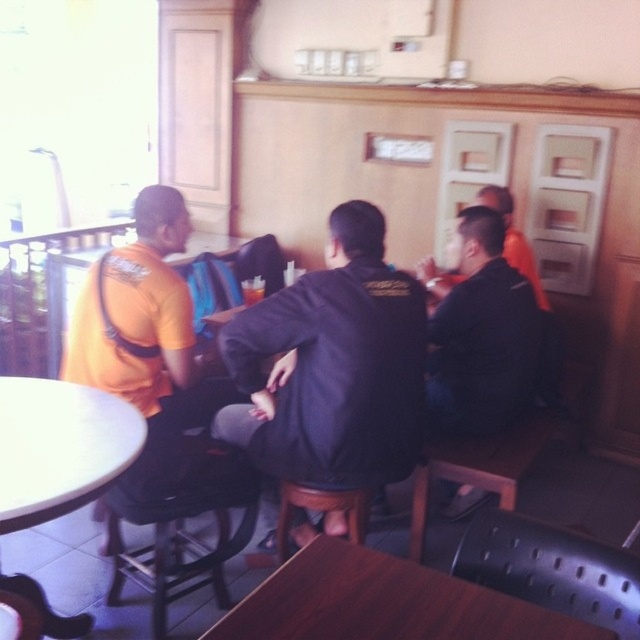
Looking at this image, is dark blue jacket at center below black matte jacket at upper right?

Yes.

Who is more forward, (483, 417) or (429, 280)?

Point (483, 417) is in front.

You are a GUI agent. You are given a task and a screenshot of the screen. Output one action in this format:
    pyautogui.click(x=<x>, y=<y>)
    Task: Click on the dark blue jacket at center
    
    Given the screenshot: What is the action you would take?
    pyautogui.click(x=481, y=333)

Is orange matte shirt at left smaller than black matte jacket at upper right?

Incorrect, orange matte shirt at left is not smaller in size than black matte jacket at upper right.

What do you see at coordinates (141, 328) in the screenshot? I see `orange matte shirt at left` at bounding box center [141, 328].

Does point (144, 280) lie in front of point (502, 211)?

Yes, point (144, 280) is in front of point (502, 211).

You are a GUI agent. You are given a task and a screenshot of the screen. Output one action in this format:
    pyautogui.click(x=<x>, y=<y>)
    Task: Click on the orange matte shirt at left
    The width and height of the screenshot is (640, 640).
    Given the screenshot: What is the action you would take?
    pyautogui.click(x=141, y=328)

Is dark blue jacket at center positioned before white glossy round table at lower left?

That is False.

Which is in front, point (488, 413) or point (67, 620)?

Positioned in front is point (67, 620).

Find the location of `dark blue jacket at center`. dark blue jacket at center is located at coordinates (481, 333).